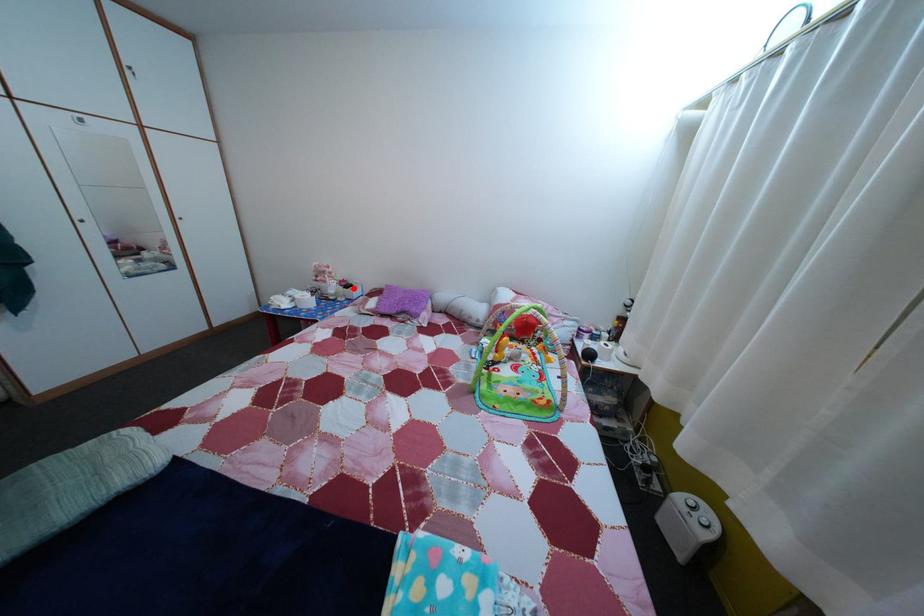
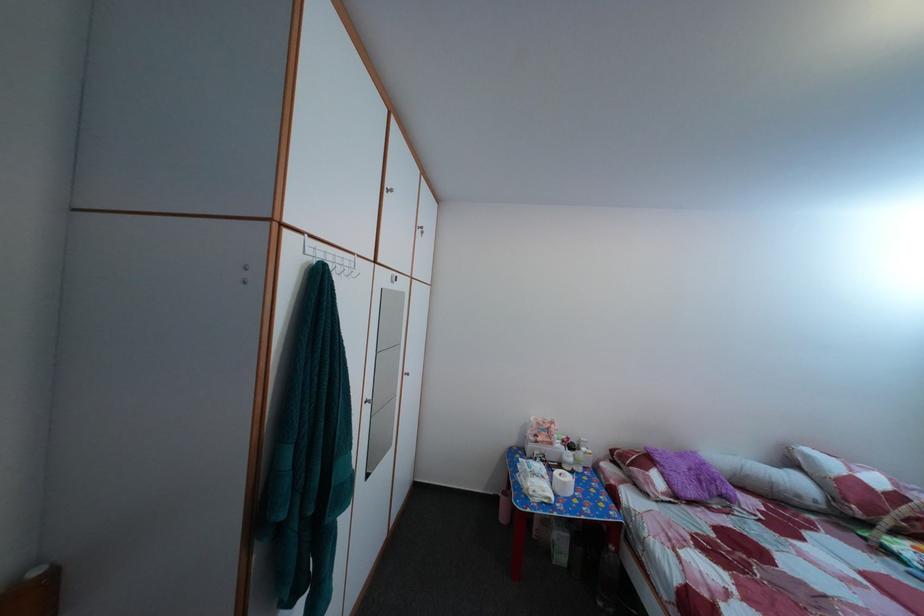
The point at the highlighted location is marked in the first image. Where is the corresponding point in the second image?

(578, 447)